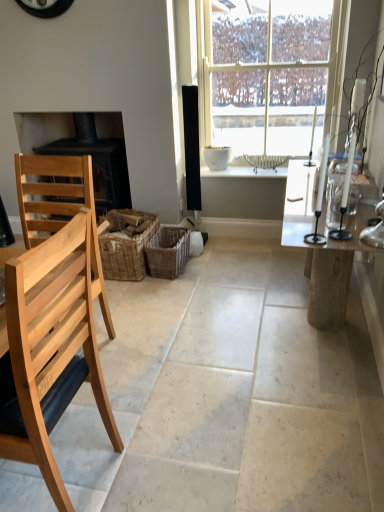
Identify the location of free space in front of clear glass table at right. (272, 418).